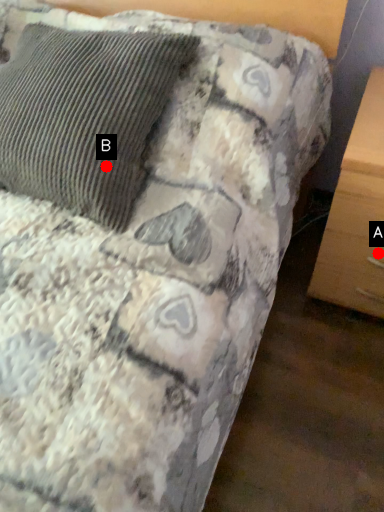
Question: Two points are circled on the image, labeled by A and B beside each circle. Which point is closer to the camera taking this photo?

Choices:
 (A) A is closer
 (B) B is closer

Answer: (B)